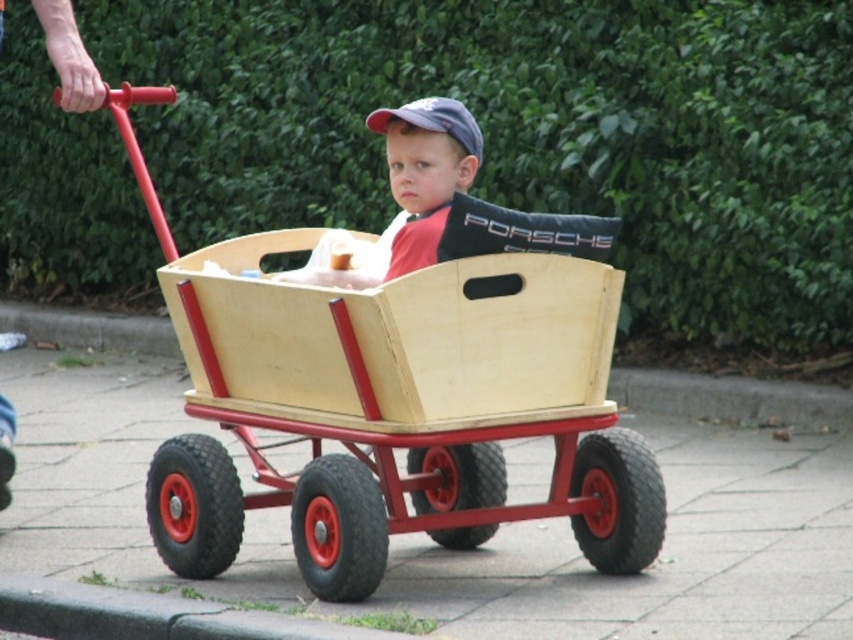
You are standing at the origin point in the image. The wooden wagon at center is located at point (399, 381). If you want to walk towards the wooden wagon at center, in which direction should you move?

The wooden wagon at center is located at point (399, 381), so you should move towards that coordinate to reach it.

You are standing in a garden and see two wagons, the wooden wagon at center and the matte wood wagon at center. Which wagon is positioned to the left?

The wooden wagon at center is positioned to the left of the matte wood wagon at center.

You are helping to organize a toy store. You have two wagons displayed side by side in the middle of the store. The wooden wagon at center and the matte wood wagon at center. A customer asks which wagon is bigger. How do you respond?

The wooden wagon at center is larger in size than the matte wood wagon at center.